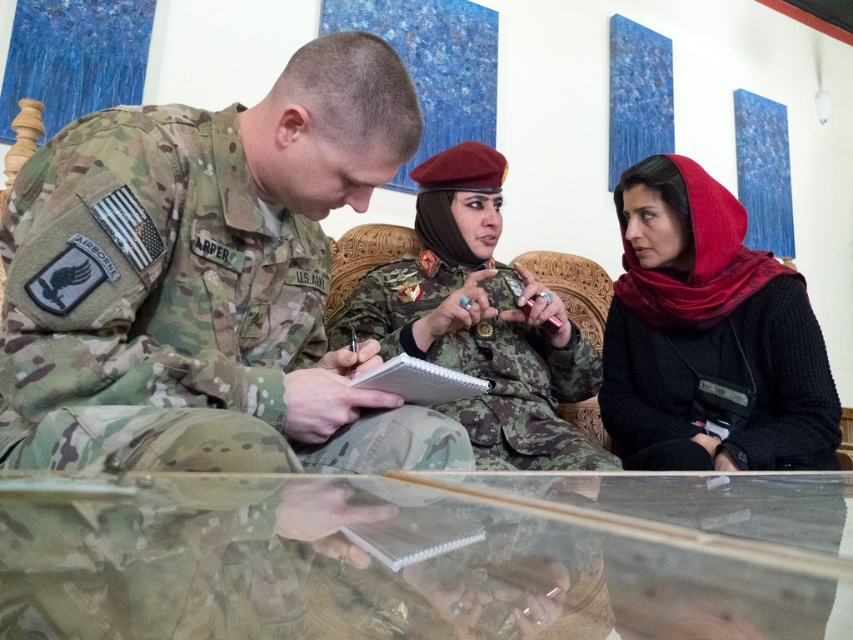
You are a military planner trying to set up a meeting in this room. You need to place a new chair for an additional attendee. Where should you place the chair so it doesn not block the view of the camouflage uniform at center?

The camouflage uniform at center is located at point (207,282). To avoid blocking its view, place the new chair in an open area away from that coordinate, ensuring clear visibility from the camouflage uniform at center.

You are a drone operator trying to navigate a small drone through the meeting room. You need to fly the drone from point A at coordinates point (x=520, y=276) to point B at coordinates point (x=437, y=394). Considering the positions of the two points, will the drone need to ascend or descend while moving from point A to point B?

The drone will need to descend while moving from point A at coordinates point (x=520, y=276) to point B at coordinates point (x=437, y=394) because point A is further to the viewer than point B, indicating it is closer and higher in elevation.

In the scene shown: You are a security guard standing in the meeting room. You need to check the ID of the camouflage fabric uniform at center. Can you reach them within 2 meters without moving?

The camouflage fabric uniform at center and viewer are 1.37 meters apart, so yes, you can reach them within 2 meters without moving.